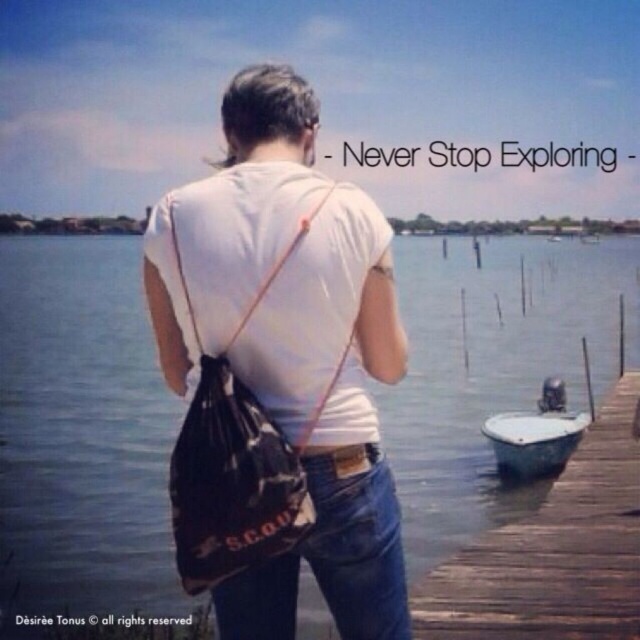
Can you confirm if black canvas bag at center is positioned below jeans at center?

No.

Locate an element on the screen. The width and height of the screenshot is (640, 640). black canvas bag at center is located at coordinates (236, 458).

Which is more to the right, blue water at center or black canvas bag at center?

blue water at center

Is blue water at center above black canvas bag at center?

Correct, blue water at center is located above black canvas bag at center.

This screenshot has width=640, height=640. Describe the element at coordinates (83, 429) in the screenshot. I see `blue water at center` at that location.

Find the location of a particular element. This screenshot has height=640, width=640. blue water at center is located at coordinates (83, 429).

Does black canvas bag at center have a lesser width compared to green plastic boat at lower right?

Correct, black canvas bag at center's width is less than green plastic boat at lower right's.

Can you confirm if black canvas bag at center is bigger than green plastic boat at lower right?

Actually, black canvas bag at center might be smaller than green plastic boat at lower right.

Where is `black canvas bag at center`? This screenshot has height=640, width=640. black canvas bag at center is located at coordinates (236, 458).

What are the coordinates of `black canvas bag at center` in the screenshot? It's located at (236, 458).